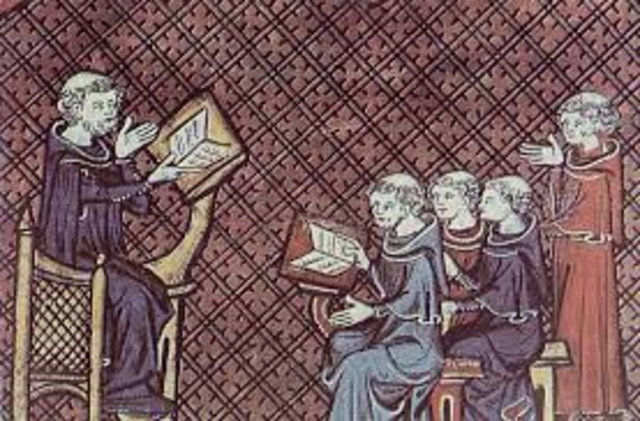
Locate an element on the screen. Image resolution: width=640 pixels, height=421 pixels. desk is located at coordinates (x=560, y=355).